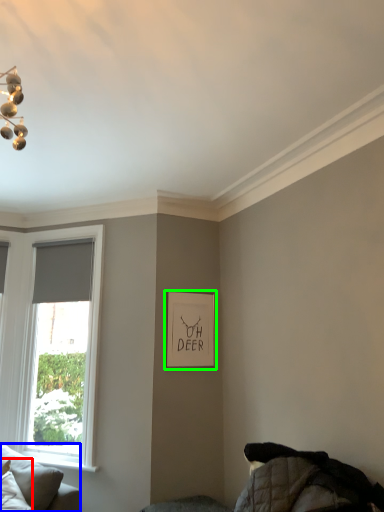
Question: Which object is positioned closest to pillow (highlighted by a red box)? Select from studio couch (highlighted by a blue box) and picture frame (highlighted by a green box).

Choices:
 (A) studio couch
 (B) picture frame

Answer: (A)